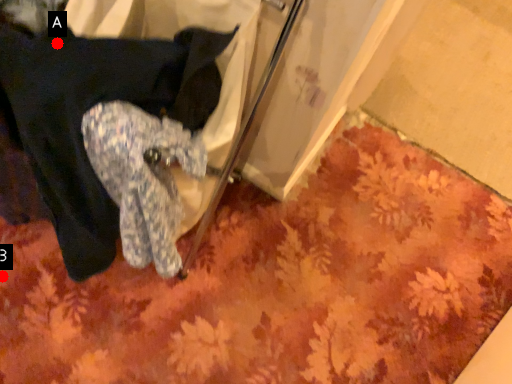
Question: Two points are circled on the image, labeled by A and B beside each circle. Which point appears closest to the camera in this image?

Choices:
 (A) A is closer
 (B) B is closer

Answer: (A)